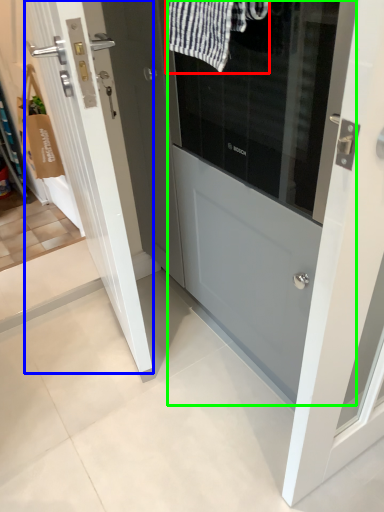
Question: Based on their relative distances, which object is farther from bath towel (highlighted by a red box)? Choose from door (highlighted by a blue box) and door (highlighted by a green box).

Choices:
 (A) door
 (B) door

Answer: (A)